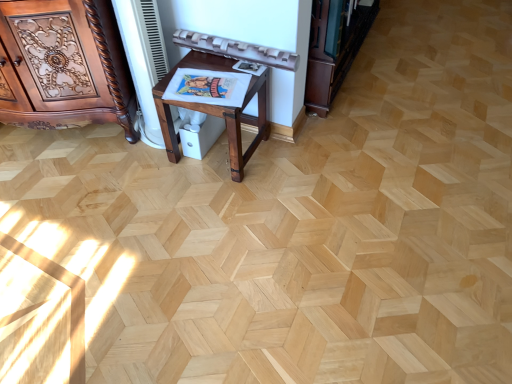
The width and height of the screenshot is (512, 384). I want to click on blank space to the left of mahogany wood table at center, so click(143, 168).